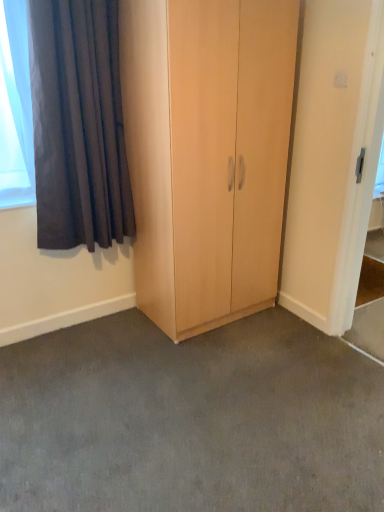
This screenshot has width=384, height=512. Identify the location of free location above gray carpet at center (from a real-world perspective). (206, 386).